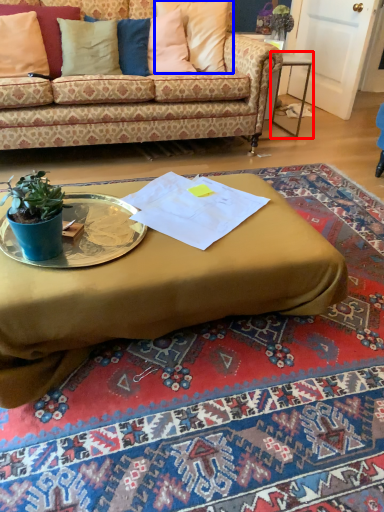
Question: Among these objects, which one is nearest to the camera, table (highlighted by a red box) or pillow (highlighted by a blue box)?

Choices:
 (A) table
 (B) pillow

Answer: (B)